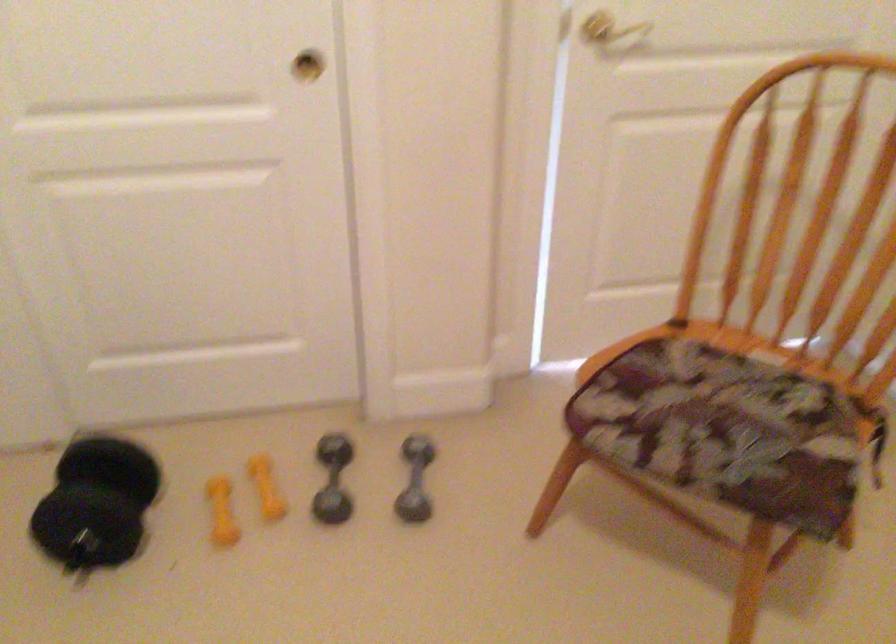
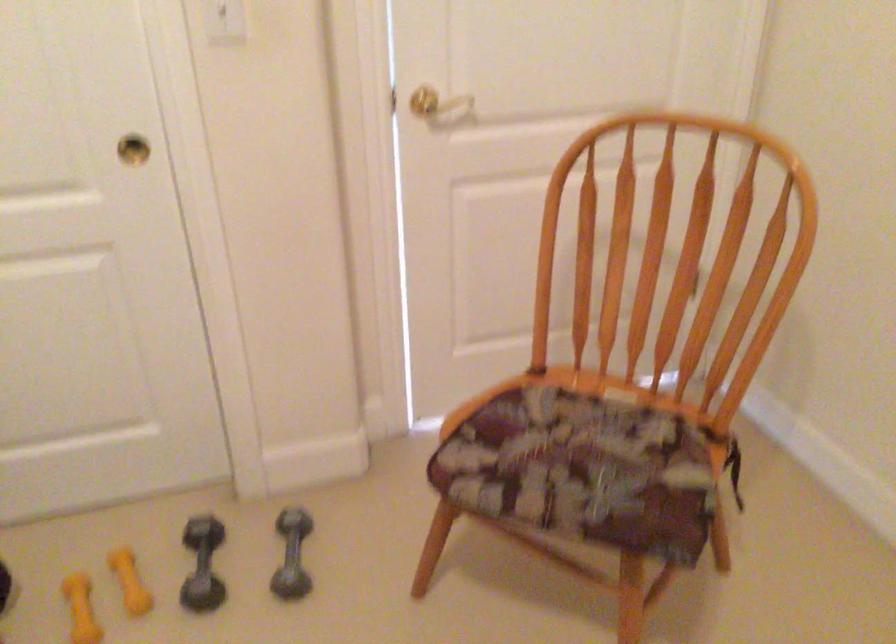
Where in the second image is the point corresponding to [271,484] from the first image?

(128, 581)